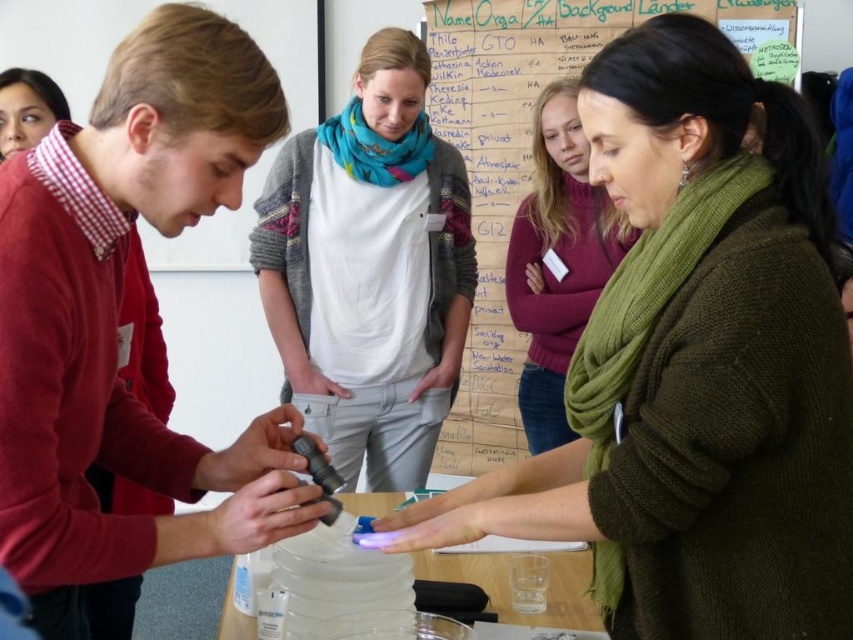
The height and width of the screenshot is (640, 853). Describe the element at coordinates (117, 317) in the screenshot. I see `matte black phone at left` at that location.

Looking at this image, which is below, matte black phone at left or clear plastic table at center?

clear plastic table at center

Between point (42, 275) and point (554, 620), which one is positioned in front?

Point (42, 275) is in front.

What are the coordinates of `matte black phone at left` in the screenshot? It's located at (117, 317).

Who is positioned more to the right, green knitted scarf at center or clear plastic table at center?

Positioned to the right is green knitted scarf at center.

Is point (547, 97) positioned behind point (517, 616)?

Yes, it is.

Does point (608, 232) lie behind point (532, 612)?

That is True.

You are a GUI agent. You are given a task and a screenshot of the screen. Output one action in this format:
    pyautogui.click(x=<x>, y=<y>)
    Task: Click on the green knitted scarf at center
    
    Given the screenshot: What is the action you would take?
    pyautogui.click(x=558, y=259)

Who is shorter, white cotton shirt at center or wooden noticeboard at upper center?

white cotton shirt at center is shorter.

Is white cotton shirt at center thinner than wooden noticeboard at upper center?

Indeed, white cotton shirt at center has a lesser width compared to wooden noticeboard at upper center.

Locate an element on the screen. white cotton shirt at center is located at coordinates (369, 269).